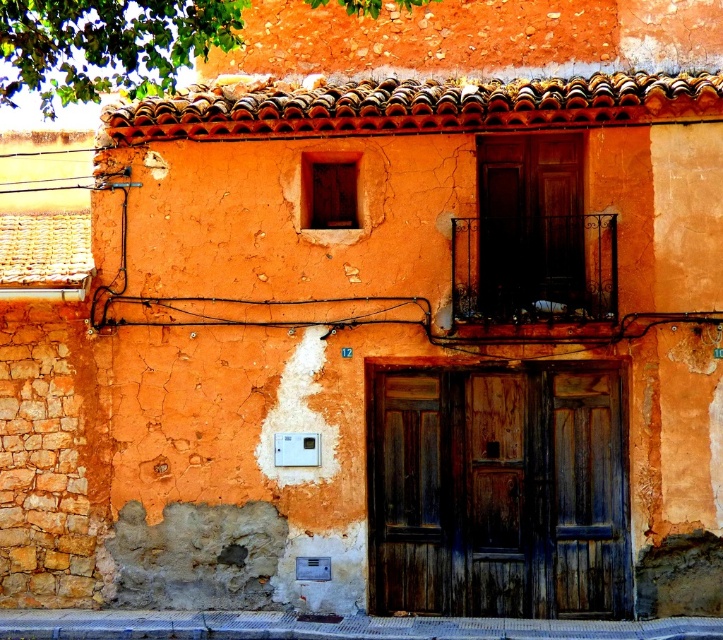
Is dark brown wooden door at center positioned before terracotta tiles at upper center?

No, dark brown wooden door at center is further to the viewer.

Can you confirm if dark brown wooden door at center is smaller than terracotta tiles at upper center?

Indeed, dark brown wooden door at center has a smaller size compared to terracotta tiles at upper center.

Who is more forward, (x=534, y=486) or (x=568, y=92)?

Point (x=568, y=92) is more forward.

Locate an element on the screen. The width and height of the screenshot is (723, 640). dark brown wooden door at center is located at coordinates (497, 493).

Between dark brown wooden door at center and wooden door at center, which one appears on the left side from the viewer's perspective?

dark brown wooden door at center

Which is in front, point (491, 541) or point (565, 260)?

Positioned in front is point (491, 541).

In order to click on dark brown wooden door at center in this screenshot , I will do `click(497, 493)`.

Does terracotta tiles at upper center appear under wooden door at center?

Incorrect, terracotta tiles at upper center is not positioned below wooden door at center.

Who is more distant from viewer, [403,97] or [496,164]?

The point [496,164] is behind.

Image resolution: width=723 pixels, height=640 pixels. Identify the location of terracotta tiles at upper center. (411, 106).